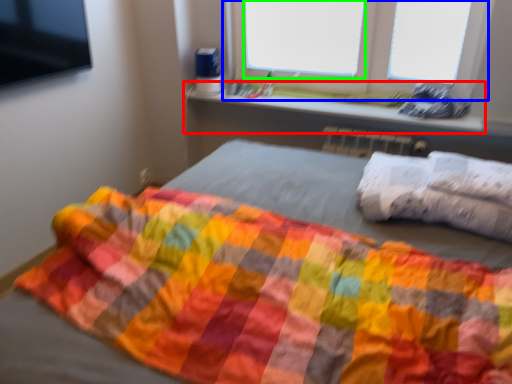
Question: Considering the real-world distances, which object is farthest from window sill (highlighted by a red box)? window (highlighted by a blue box) or window screen (highlighted by a green box)?

Choices:
 (A) window
 (B) window screen

Answer: (B)